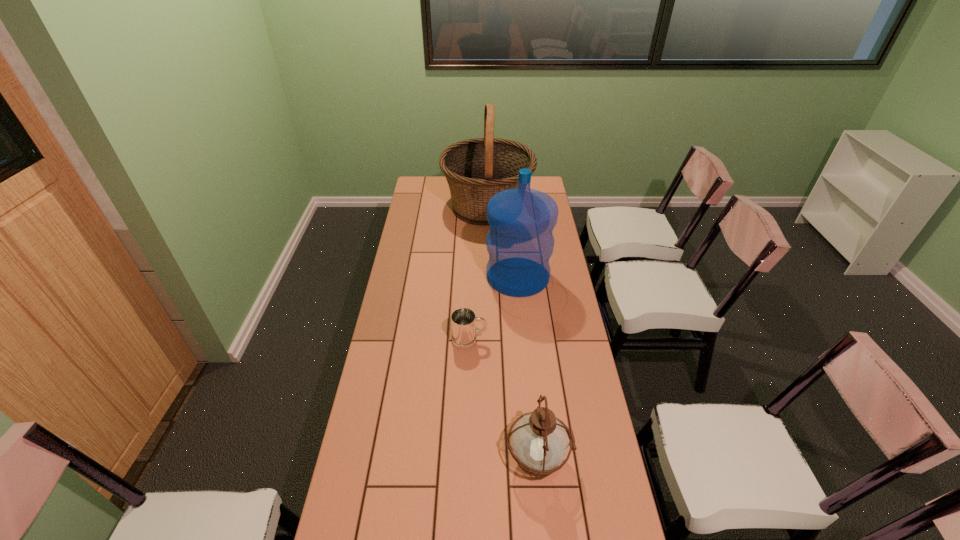
Locate an element on the screen. The height and width of the screenshot is (540, 960). object present at the far edge is located at coordinates pos(476,169).

Find the location of `basket that is positioned at the right edge`. basket that is positioned at the right edge is located at coordinates (476, 169).

The height and width of the screenshot is (540, 960). What are the coordinates of `water jug at the right edge` in the screenshot? It's located at (520, 242).

At what (x,y) coordinates should I click in order to perform the action: click on oil lamp positioned at the right edge. Please return your answer as a coordinate pair (x, y). The image size is (960, 540). Looking at the image, I should click on (539, 441).

Identify the location of object that is at the far right corner. This screenshot has height=540, width=960. (476, 169).

In the image, there is a desktop. At what (x,y) coordinates should I click in order to perform the action: click on free region at the far edge. Please return your answer as a coordinate pair (x, y). Looking at the image, I should click on (446, 191).

In the image, there is a desktop. At what (x,y) coordinates should I click in order to perform the action: click on free space at the left edge. Please return your answer as a coordinate pair (x, y). Looking at the image, I should click on [x=397, y=258].

The height and width of the screenshot is (540, 960). I want to click on vacant area at the right edge of the desktop, so click(562, 306).

Find the location of a particular element. The height and width of the screenshot is (540, 960). free spot between the mug and the basket is located at coordinates (478, 273).

Locate an element on the screen. The width and height of the screenshot is (960, 540). unoccupied area between the second nearest object and the third nearest object is located at coordinates (493, 308).